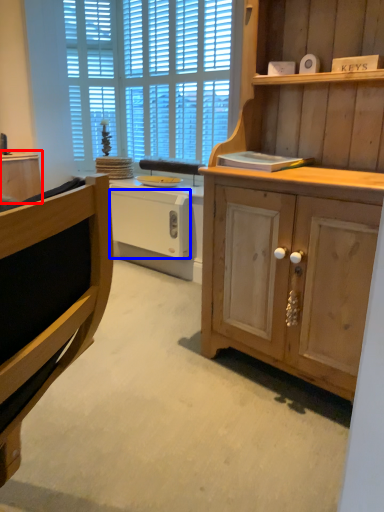
Question: Which object appears farthest to the camera in this image, cabinetry (highlighted by a red box) or drawer (highlighted by a blue box)?

Choices:
 (A) cabinetry
 (B) drawer

Answer: (A)